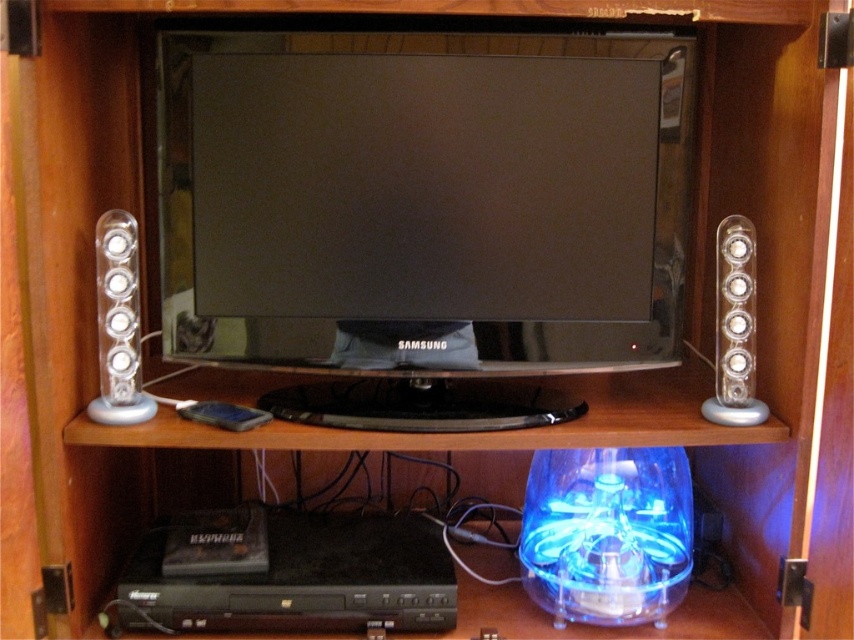
You are trying to place a 30 cm wide decorative item between the satin black flat screen at center and the clear plastic speaker at left on the shelf. Based on the space available, will it fit?

The distance between the satin black flat screen at center and the clear plastic speaker at left is 32.97 centimeters. Since the decorative item is 30 cm wide, it will fit within the available space.

You are standing in front of the entertainment unit and want to place a new device on the shelf. You have two points marked as potential spots for placement. The first point is at coordinates point (420, 268) and the second is at point (717, 381). Which of these points is closer to you?

Point (420, 268) is closer to the camera than point (717, 381), so the first point is closer to you.

What is the object located at the coordinates point [118,323]?

The object at point [118,323] is a clear plastic speaker at left.